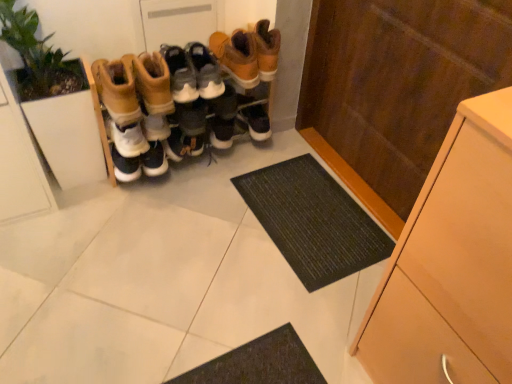
Where is `matte wood cupboard at right`? The width and height of the screenshot is (512, 384). matte wood cupboard at right is located at coordinates (396, 88).

Measure the distance between black rubber doormat at center and camera.

black rubber doormat at center and camera are 1.37 meters apart from each other.

Image resolution: width=512 pixels, height=384 pixels. What do you see at coordinates (54, 99) in the screenshot?
I see `green leafy plant at left` at bounding box center [54, 99].

Where is `leather boots at center, the 2th footwear viewed from the left`? leather boots at center, the 2th footwear viewed from the left is located at coordinates (188, 98).

From the image's perspective, is matte wood cupboard at right on leather boots at center, the 1th footwear in the left-to-right sequence?

Actually, matte wood cupboard at right appears below leather boots at center, the 1th footwear in the left-to-right sequence, in the image.

Considering the relative sizes of matte wood cupboard at right and leather boots at center, the 1th footwear in the left-to-right sequence, in the image provided, is matte wood cupboard at right shorter than leather boots at center, the 1th footwear in the left-to-right sequence,?

In fact, matte wood cupboard at right may be taller than leather boots at center, the 1th footwear in the left-to-right sequence.

Based on the photo, how different are the orientations of matte wood cupboard at right and leather boots at center, the 1th footwear in the left-to-right sequence, in degrees?

There is a 90-degree angle between the facing directions of matte wood cupboard at right and leather boots at center, the 1th footwear in the left-to-right sequence.

Is light wood cabinet at right bigger than brown suede boots at center, the 1th footwear viewed from the right?

Yes.

Does light wood cabinet at right turn towards brown suede boots at center, which appears as the 3th footwear when viewed from the left?

No.

Is point (467, 247) farther from viewer compared to point (246, 79)?

That is False.

This screenshot has width=512, height=384. Find the location of `cabinetry on the right side of green leafy plant at left`. cabinetry on the right side of green leafy plant at left is located at coordinates (451, 263).

Can you confirm if light wood cabinet at right is shorter than green leafy plant at left?

No, light wood cabinet at right is not shorter than green leafy plant at left.

Is light wood cabinet at right not inside green leafy plant at left?

That's correct, light wood cabinet at right is outside of green leafy plant at left.

From a real-world perspective, is black rubber doormat at center physically located above or below leather boots at center, the second footwear in the right-to-left sequence?

Clearly, from a real-world perspective, black rubber doormat at center is below leather boots at center, the second footwear in the right-to-left sequence.

From their relative heights in the image, would you say black rubber doormat at center is taller or shorter than leather boots at center, the 2th footwear viewed from the left?

Clearly, black rubber doormat at center is shorter compared to leather boots at center, the 2th footwear viewed from the left.

Considering the positions of points (376, 254) and (140, 157), is point (376, 254) farther from camera compared to point (140, 157)?

No, (376, 254) is closer to viewer.

Is black rubber doormat at center touching leather boots at center, the second footwear in the right-to-left sequence?

No, black rubber doormat at center is not next to leather boots at center, the second footwear in the right-to-left sequence.

Is brown suede boots at center, the 1th footwear viewed from the right, turned away from light wood cabinet at right?

No, brown suede boots at center, the 1th footwear viewed from the right, is not facing the opposite direction of light wood cabinet at right.

Would you consider brown suede boots at center, the 1th footwear viewed from the right, to be distant from light wood cabinet at right?

Yes, brown suede boots at center, the 1th footwear viewed from the right, is far from light wood cabinet at right.

Is brown suede boots at center, the 1th footwear viewed from the right, bigger than light wood cabinet at right?

No, brown suede boots at center, the 1th footwear viewed from the right, is not bigger than light wood cabinet at right.

Which object is more forward, brown suede boots at center, which appears as the 3th footwear when viewed from the left, or light wood cabinet at right?

light wood cabinet at right.

Would you consider black rubber doormat at center to be distant from light wood cabinet at right?

Actually, black rubber doormat at center and light wood cabinet at right are a little close together.

Is black rubber doormat at center aimed at light wood cabinet at right?

No, black rubber doormat at center does not turn towards light wood cabinet at right.

Which of these two, black rubber doormat at center or light wood cabinet at right, is bigger?

light wood cabinet at right.

Does black rubber doormat at center have a lesser width compared to light wood cabinet at right?

No.

Between point (434, 366) and point (267, 221), which one is positioned in front?

Positioned in front is point (434, 366).

Is the surface of light wood cabinet at right in direct contact with black rubber doormat at center?

light wood cabinet at right and black rubber doormat at center are not in contact.

Is light wood cabinet at right positioned with its back to black rubber doormat at center?

No.

From a real-world perspective, does light wood cabinet at right stand above black rubber doormat at center?

Yes.

Find the location of `cupboard in front of the leather boots at center, the 3th footwear viewed from the right`. cupboard in front of the leather boots at center, the 3th footwear viewed from the right is located at coordinates (396, 88).

From the image's perspective, starting from the light wood cabinet at right, which footwear is the 3rd one above? Please provide its 2D coordinates.

[(237, 56)]

From the image, which object appears to be farther from light wood cabinet at right, matte wood cupboard at right or leather boots at center, the 2th footwear viewed from the left?

leather boots at center, the 2th footwear viewed from the left, is further to light wood cabinet at right.

Which object lies further to the anchor point brown suede boots at center, which appears as the 3th footwear when viewed from the left, matte wood cupboard at right or light wood cabinet at right?

light wood cabinet at right is further to brown suede boots at center, which appears as the 3th footwear when viewed from the left.

From the image, which object appears to be farther from light wood cabinet at right, leather boots at center, the 1th footwear in the left-to-right sequence, or leather boots at center, the 2th footwear viewed from the left?

leather boots at center, the 1th footwear in the left-to-right sequence, lies further to light wood cabinet at right than the other object.

Based on their spatial positions, is matte wood cupboard at right or brown suede boots at center, the 1th footwear viewed from the right, closer to leather boots at center, the second footwear in the right-to-left sequence?

The object closer to leather boots at center, the second footwear in the right-to-left sequence, is brown suede boots at center, the 1th footwear viewed from the right.

When comparing their distances from black rubber doormat at center, does light wood cabinet at right or leather boots at center, the second footwear in the right-to-left sequence, seem further?

light wood cabinet at right.

Based on their spatial positions, is leather boots at center, the 3th footwear viewed from the right, or black rubber doormat at center closer to light wood cabinet at right?

Based on the image, black rubber doormat at center appears to be nearer to light wood cabinet at right.

When comparing their distances from light wood cabinet at right, does green leafy plant at left or leather boots at center, the 3th footwear viewed from the right, seem closer?

The object closer to light wood cabinet at right is leather boots at center, the 3th footwear viewed from the right.

Looking at this image, estimate the real-world distances between objects in this image. Which object is further from leather boots at center, the 1th footwear in the left-to-right sequence, black rubber doormat at center or light wood cabinet at right?

light wood cabinet at right is further to leather boots at center, the 1th footwear in the left-to-right sequence.

Find the location of a particular element. The image size is (512, 384). doormat situated between leather boots at center, the second footwear in the right-to-left sequence, and matte wood cupboard at right from left to right is located at coordinates (313, 221).

You are a GUI agent. You are given a task and a screenshot of the screen. Output one action in this format:
    pyautogui.click(x=<x>, y=<y>)
    Task: Click on the doormat located between green leafy plant at left and light wood cabinet at right in the left-right direction
    The image size is (512, 384).
    Given the screenshot: What is the action you would take?
    pyautogui.click(x=313, y=221)

Locate an element on the screen. The width and height of the screenshot is (512, 384). cupboard between light wood cabinet at right and black rubber doormat at center in the front-back direction is located at coordinates (396, 88).

You are a GUI agent. You are given a task and a screenshot of the screen. Output one action in this format:
    pyautogui.click(x=<x>, y=<y>)
    Task: Click on the cupboard between leather boots at center, the 3th footwear viewed from the right, and light wood cabinet at right from left to right
    
    Given the screenshot: What is the action you would take?
    pyautogui.click(x=396, y=88)